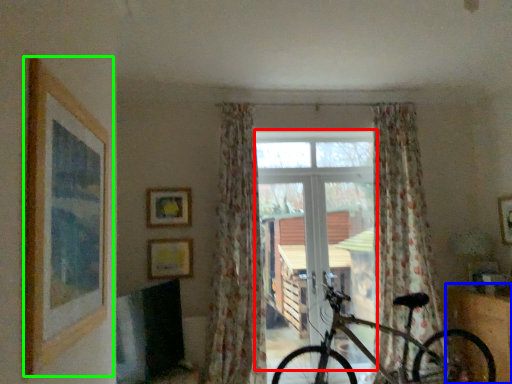
Question: Considering the real-world distances, which object is closest to window frame (highlighted by a red box)? furniture (highlighted by a blue box) or picture frame (highlighted by a green box).

Choices:
 (A) furniture
 (B) picture frame

Answer: (A)